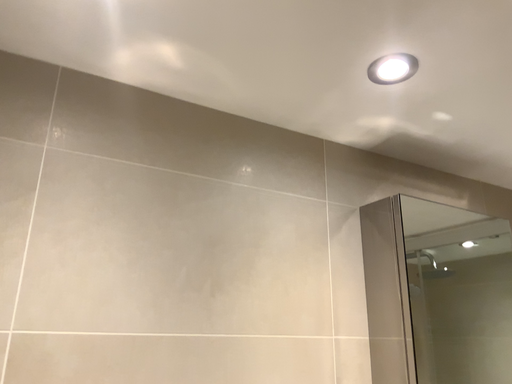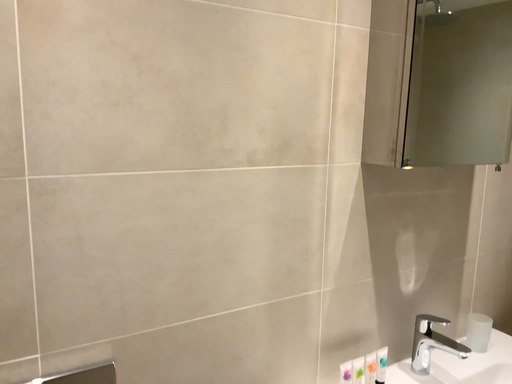
Question: How did the camera likely rotate when shooting the video?

Choices:
 (A) rotated downward
 (B) rotated upward

Answer: (A)